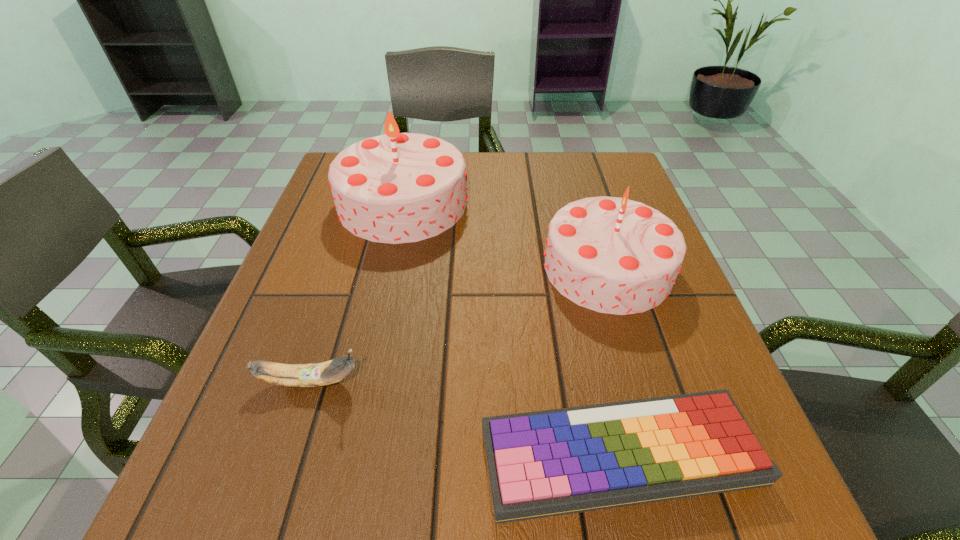
Locate an element on the screen. This screenshot has height=540, width=960. free space located 0.270m at the stem of the second shortest object is located at coordinates tap(532, 382).

Find the location of a particular element. The height and width of the screenshot is (540, 960). free space located on the left of the computer keyboard is located at coordinates (291, 455).

Identify the location of object that is at the far edge. The height and width of the screenshot is (540, 960). (395, 188).

Where is `object present at the near edge`? object present at the near edge is located at coordinates (546, 463).

The height and width of the screenshot is (540, 960). I want to click on birthday cake that is at the left edge, so click(x=395, y=188).

The width and height of the screenshot is (960, 540). I want to click on banana at the left edge, so click(x=324, y=373).

Identify the location of birthday cake located in the right edge section of the desktop. (613, 255).

The height and width of the screenshot is (540, 960). Identify the location of computer keyboard positioned at the right edge. (546, 463).

In order to click on object located at the far left corner in this screenshot , I will do `click(395, 188)`.

At what (x,y) coordinates should I click in order to perform the action: click on object present at the near right corner. Please return your answer as a coordinate pair (x, y). The height and width of the screenshot is (540, 960). Looking at the image, I should click on (546, 463).